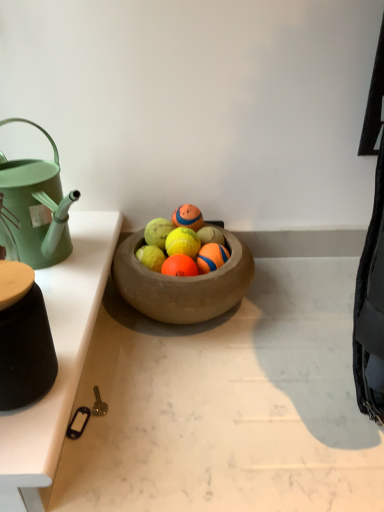
Question: From a real-world perspective, is white glossy table at left on top of orange rubber ball at center, acting as the first fruit starting from the right?

Choices:
 (A) yes
 (B) no

Answer: (B)

Question: Can you confirm if white glossy table at left is taller than orange rubber ball at center, positioned as the third fruit in left-to-right order?

Choices:
 (A) no
 (B) yes

Answer: (A)

Question: Is orange rubber ball at center, acting as the first fruit starting from the right, at the back of white glossy table at left?

Choices:
 (A) no
 (B) yes

Answer: (A)

Question: Are white glossy table at left and orange rubber ball at center, positioned as the third fruit in left-to-right order, making contact?

Choices:
 (A) no
 (B) yes

Answer: (A)

Question: From the image's perspective, is white glossy table at left over orange rubber ball at center, positioned as the third fruit in left-to-right order?

Choices:
 (A) no
 (B) yes

Answer: (A)

Question: From a real-world perspective, is yellow rubber tennis ball at center, the 2th fruit when ordered from right to left, positioned above or below white glossy table at left?

Choices:
 (A) above
 (B) below

Answer: (A)

Question: In the image, is yellow rubber tennis ball at center, the 2th fruit when ordered from right to left, positioned in front of or behind white glossy table at left?

Choices:
 (A) front
 (B) behind

Answer: (B)

Question: Is yellow rubber tennis ball at center, the 2th fruit when ordered from right to left, taller or shorter than white glossy table at left?

Choices:
 (A) tall
 (B) short

Answer: (A)

Question: Considering the positions of yellow rubber tennis ball at center, the 2th fruit when ordered from right to left, and white glossy table at left in the image, is yellow rubber tennis ball at center, the 2th fruit when ordered from right to left, wider or thinner than white glossy table at left?

Choices:
 (A) thin
 (B) wide

Answer: (A)

Question: Is point (221, 248) closer or farther from the camera than point (200, 224)?

Choices:
 (A) closer
 (B) farther

Answer: (A)

Question: In terms of height, does orange rubber ball at center, positioned as the third fruit in left-to-right order, look taller or shorter compared to rubber textured tennis ball at center?

Choices:
 (A) short
 (B) tall

Answer: (A)

Question: In the image, is orange rubber ball at center, acting as the first fruit starting from the right, on the left side or the right side of rubber textured tennis ball at center?

Choices:
 (A) right
 (B) left

Answer: (A)

Question: From the image's perspective, is orange rubber ball at center, positioned as the third fruit in left-to-right order, positioned above or below rubber textured tennis ball at center?

Choices:
 (A) above
 (B) below

Answer: (B)

Question: Looking at the image, does white glossy table at left seem bigger or smaller compared to orange rubber ball at center, positioned as the third fruit in left-to-right order?

Choices:
 (A) small
 (B) big

Answer: (B)

Question: Considering the positions of point (49, 274) and point (200, 263), is point (49, 274) closer or farther from the camera than point (200, 263)?

Choices:
 (A) closer
 (B) farther

Answer: (A)